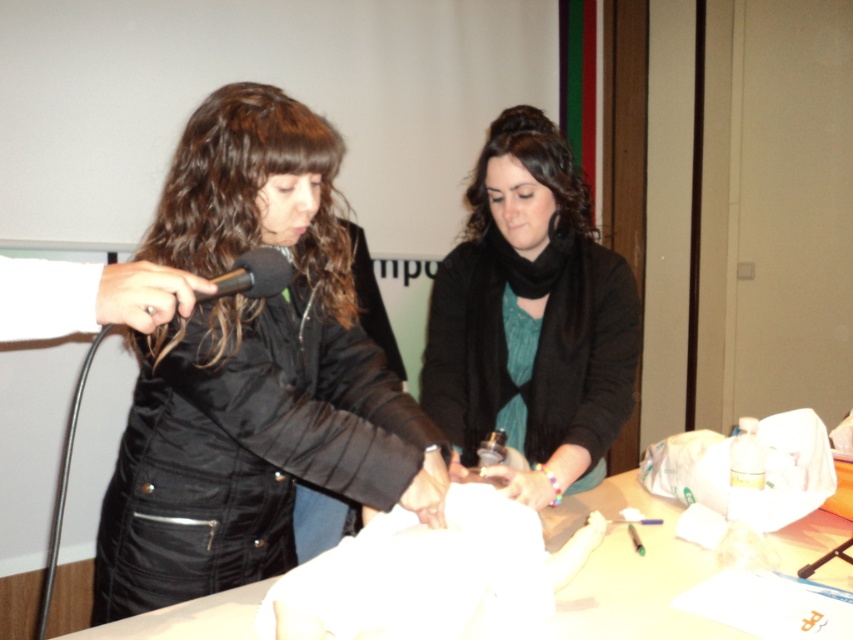
Is white paper at center below black matte microphone at upper left?

Indeed, white paper at center is positioned under black matte microphone at upper left.

At what (x,y) coordinates should I click in order to perform the action: click on white paper at center. Please return your answer as a coordinate pair (x, y). Image resolution: width=853 pixels, height=640 pixels. Looking at the image, I should click on (630, 570).

You are a GUI agent. You are given a task and a screenshot of the screen. Output one action in this format:
    pyautogui.click(x=<x>, y=<y>)
    Task: Click on the white paper at center
    
    Given the screenshot: What is the action you would take?
    pyautogui.click(x=630, y=570)

Is point (206, 365) behind point (447, 500)?

That is False.

Who is more forward, (335, 320) or (360, 602)?

Point (360, 602) is in front.

Locate an element on the screen. The image size is (853, 640). dark brown curly hair at left is located at coordinates (251, 192).

Does black matte jacket at center have a greater height compared to black matte microphone at upper left?

Yes.

Can you confirm if black matte jacket at center is thinner than black matte microphone at upper left?

No.

Is point (230, 326) more distant than point (277, 250)?

No, (230, 326) is closer to viewer.

Find the location of a particular element. black matte jacket at center is located at coordinates (250, 371).